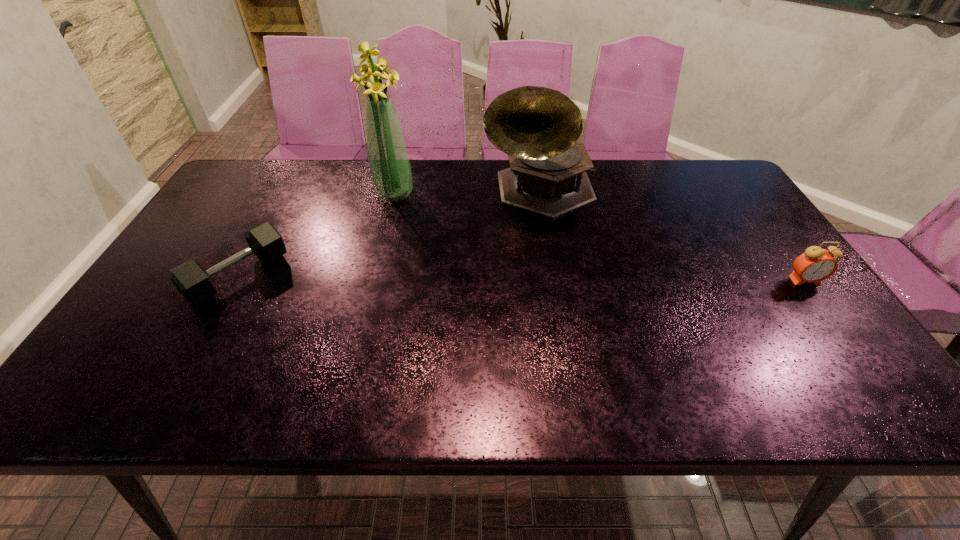
You are a GUI agent. You are given a task and a screenshot of the screen. Output one action in this format:
    pyautogui.click(x=<x>, y=<y>)
    Task: Click on the blank space located 0.170m on the front-facing side of the bouquet
    
    Given the screenshot: What is the action you would take?
    pyautogui.click(x=445, y=225)

The width and height of the screenshot is (960, 540). Find the location of `vacant space located on the front-facing side of the bouquet`. vacant space located on the front-facing side of the bouquet is located at coordinates (418, 208).

The height and width of the screenshot is (540, 960). Find the location of `vacant space located 0.250m on the front-facing side of the bouquet`. vacant space located 0.250m on the front-facing side of the bouquet is located at coordinates (466, 237).

Locate an element on the screen. The width and height of the screenshot is (960, 540). free space located on the horn direction of the second tallest object is located at coordinates (568, 311).

Locate an element on the screen. The width and height of the screenshot is (960, 540). vacant space located 0.120m on the horn direction of the second tallest object is located at coordinates (555, 257).

In order to click on vacant space situated on the horn direction of the second tallest object in this screenshot , I will do `click(572, 324)`.

What are the coordinates of `bouquet that is positioned at the far edge` in the screenshot? It's located at (389, 167).

Where is `phonograph record at the far edge`? Image resolution: width=960 pixels, height=540 pixels. phonograph record at the far edge is located at coordinates pos(538,127).

This screenshot has width=960, height=540. I want to click on object present at the left edge, so click(195, 284).

I want to click on object at the right edge, so click(815, 265).